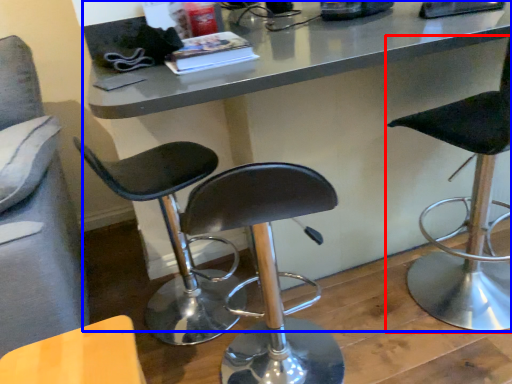
Question: Which object appears farthest to the camera in this image, chair (highlighted by a red box) or table (highlighted by a blue box)?

Choices:
 (A) chair
 (B) table

Answer: (B)